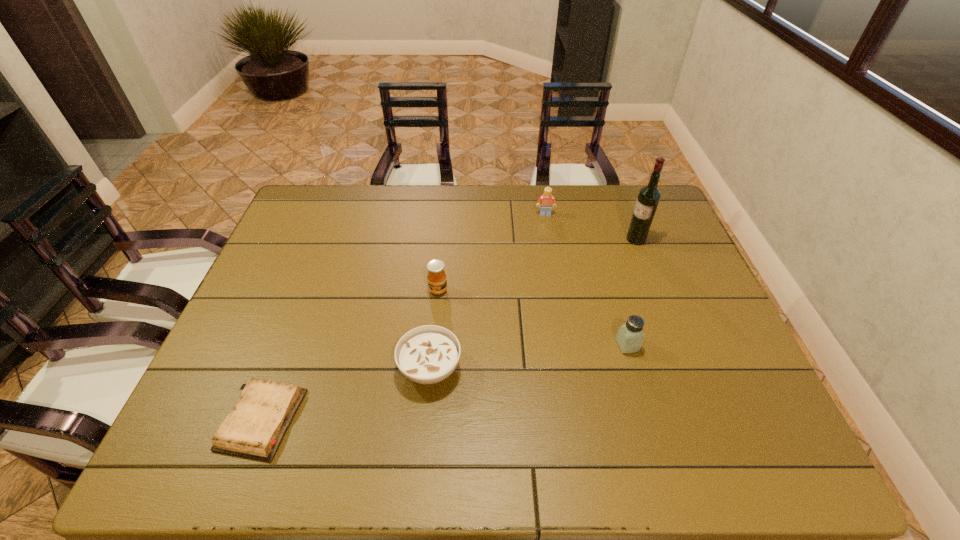
What are the coordinates of `free spot between the second farthest object and the third farthest object` in the screenshot? It's located at (537, 265).

This screenshot has height=540, width=960. What are the coordinates of `unoccupied area between the leftmost object and the fourth nearest object` in the screenshot? It's located at (350, 355).

Identify the location of free space between the saltshaker and the soup bowl. This screenshot has width=960, height=540. (529, 357).

You are a GUI agent. You are given a task and a screenshot of the screen. Output one action in this format:
    pyautogui.click(x=<x>, y=<y>)
    Task: Click on the vacant region between the third farthest object and the leftmost object
    The width and height of the screenshot is (960, 540).
    Given the screenshot: What is the action you would take?
    pyautogui.click(x=350, y=355)

The width and height of the screenshot is (960, 540). In order to click on free spot between the diary and the soup bowl in this screenshot , I will do `click(347, 394)`.

Identify which object is the closest to the wine bottle. Please provide its 2D coordinates. Your answer should be formatted as a tuple, i.e. [(x, y)], where the tuple contains the x and y coordinates of a point satisfying the conditions above.

[(547, 200)]

Image resolution: width=960 pixels, height=540 pixels. Identify the location of object that is the third nearest to the saltshaker. (437, 282).

This screenshot has height=540, width=960. I want to click on free space that satisfies the following two spatial constraints: 1. on the front-facing side of the Lego; 2. on the left side of the saltshaker, so click(567, 345).